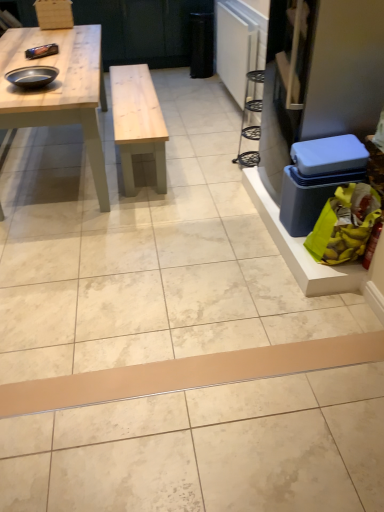
The width and height of the screenshot is (384, 512). In order to click on free space above beige matte plank at center (from a real-world perspective) in this screenshot , I will do `click(234, 368)`.